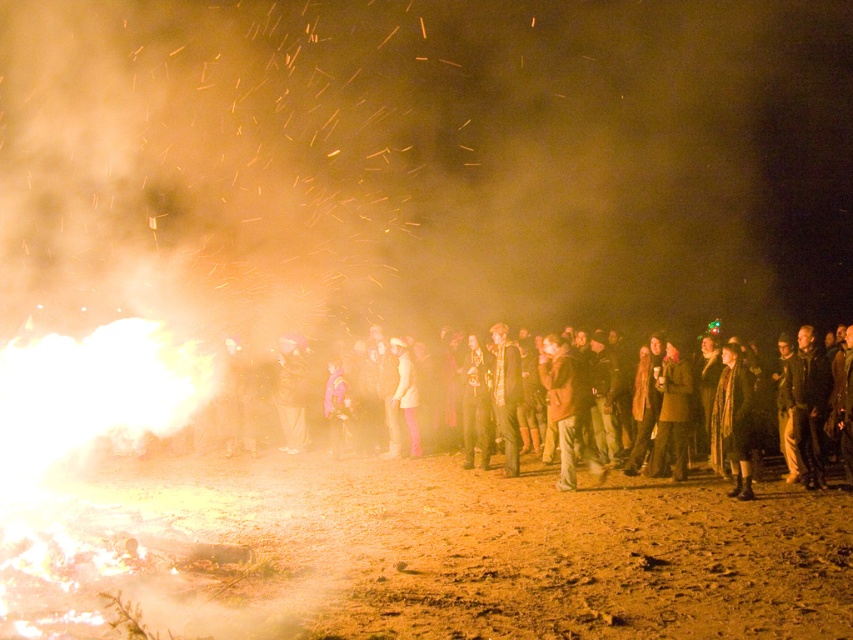
Question: Which point is farther from the camera taking this photo?

Choices:
 (A) (712, 477)
 (B) (277, 576)

Answer: (A)

Question: Is brown sandy ground at lower left below dark brown leather jackets at center?

Choices:
 (A) no
 (B) yes

Answer: (A)

Question: Which point is farther to the camera?

Choices:
 (A) (476, 550)
 (B) (367, 467)

Answer: (B)

Question: Observing the image, what is the correct spatial positioning of brown sandy ground at lower left in reference to dark brown leather jackets at center?

Choices:
 (A) above
 (B) below

Answer: (A)

Question: Does brown sandy ground at lower left have a greater width compared to dark brown leather jackets at center?

Choices:
 (A) no
 (B) yes

Answer: (B)

Question: Among these points, which one is nearest to the camera?

Choices:
 (A) (178, 620)
 (B) (424, 490)

Answer: (A)